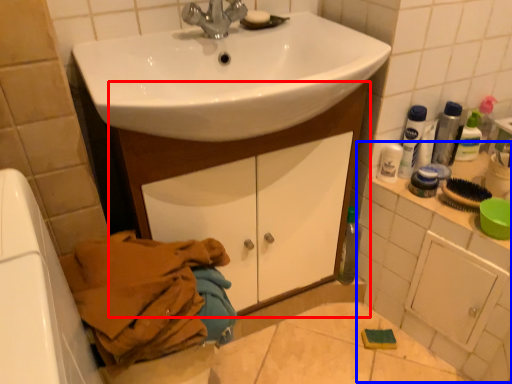
Question: Among these objects, which one is nearest to the camera, bathroom cabinet (highlighted by a red box) or counter top (highlighted by a blue box)?

Choices:
 (A) bathroom cabinet
 (B) counter top

Answer: (A)